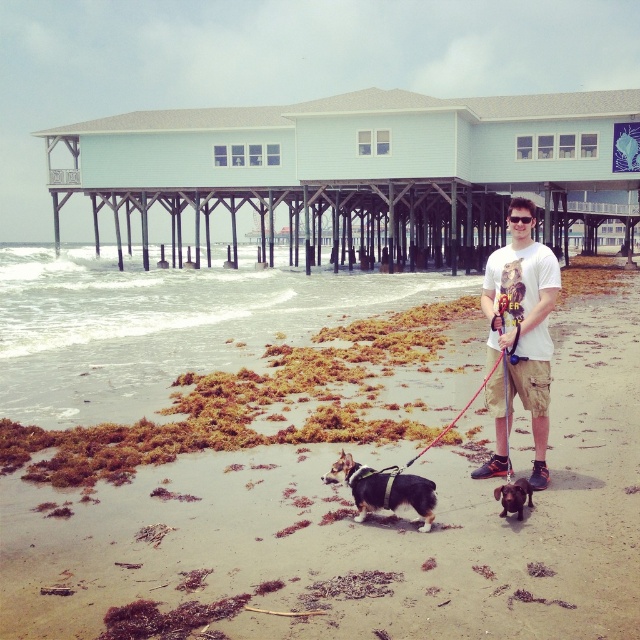
Who is more forward, (406, 476) or (512, 492)?

Point (406, 476)

Based on the photo, does brown and white fur at center have a greater width compared to black glossy dog at lower center?

Correct, the width of brown and white fur at center exceeds that of black glossy dog at lower center.

You are a GUI agent. You are given a task and a screenshot of the screen. Output one action in this format:
    pyautogui.click(x=<x>, y=<y>)
    Task: Click on the brown and white fur at center
    This screenshot has height=640, width=640.
    Given the screenshot: What is the action you would take?
    (x=384, y=490)

From the picture: Is the position of white cotton t-shirt at center less distant than that of brown and white fur at center?

No, it is behind brown and white fur at center.

Which is in front, point (509, 397) or point (365, 508)?

Positioned in front is point (365, 508).

This screenshot has height=640, width=640. Identify the location of white cotton t-shirt at center. (518, 342).

Find the location of `white cotton t-shirt at center`. white cotton t-shirt at center is located at coordinates (518, 342).

Which of these two, white cotton t-shirt at center or black glossy dog at lower center, stands shorter?

black glossy dog at lower center

I want to click on white cotton t-shirt at center, so click(518, 342).

Find the location of `white cotton t-shirt at center`. white cotton t-shirt at center is located at coordinates (518, 342).